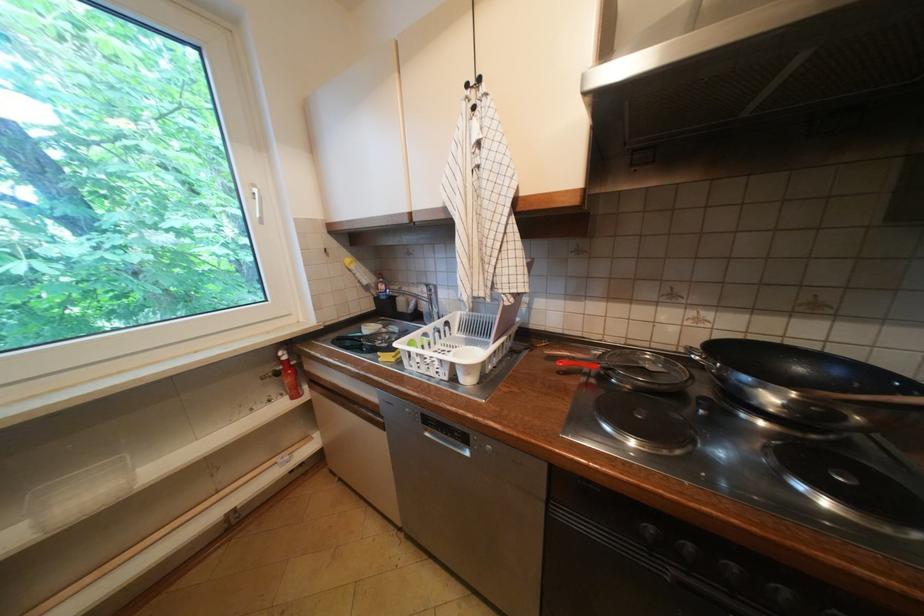
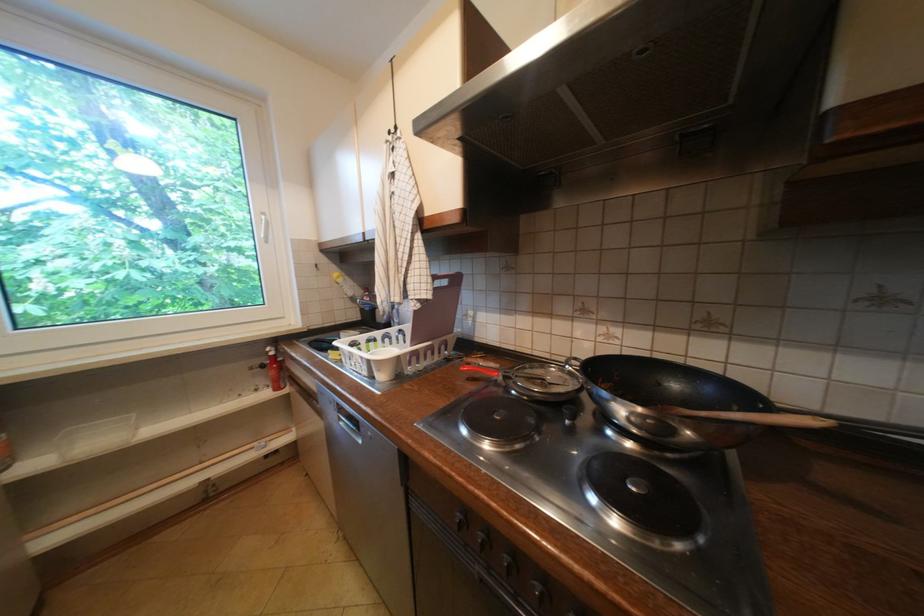
Question: The images are taken continuously from a first-person perspective. In which direction are you moving?

Choices:
 (A) Left
 (B) Right
 (C) Forward
 (D) Backward

Answer: (B)